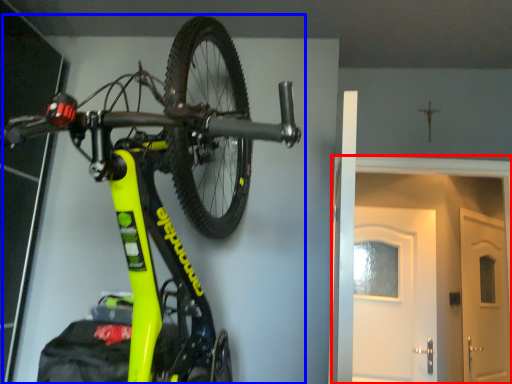
Question: Which of the following is the closest to the observer, door (highlighted by a red box) or bicycle (highlighted by a blue box)?

Choices:
 (A) door
 (B) bicycle

Answer: (B)